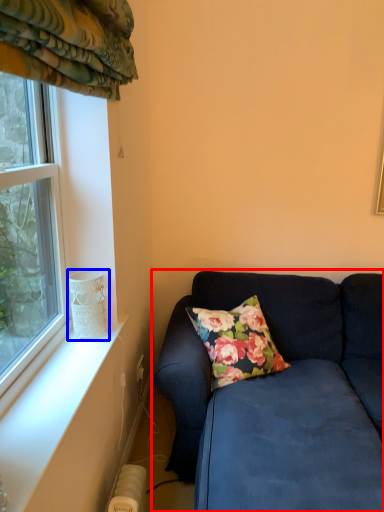
Question: Among these objects, which one is nearest to the camera, studio couch (highlighted by a red box) or glass vase (highlighted by a blue box)?

Choices:
 (A) studio couch
 (B) glass vase

Answer: (A)